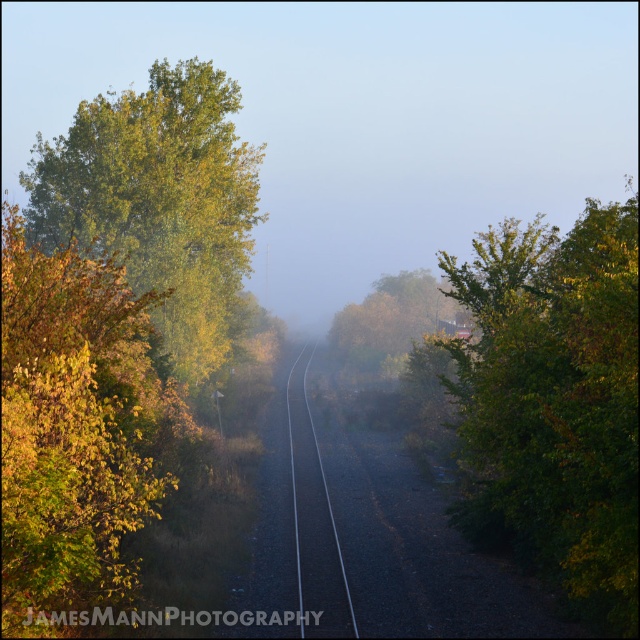
You are a photographer wanting to capture the golden foliage at left and the black asphalt train track at center in the same frame. Based on their positions, which object would you need to focus on first if you start from the left side?

The golden foliage at left is positioned on the left side of black asphalt train track at center, so you would need to focus on the golden foliage at left first since it is closer to the left side.

You are a railway inspector checking the tracks. You notice the foggy mist at center and the green leafy tree at right. Which object is higher in the scene?

The foggy mist at center is located above the green leafy tree at right, so it is higher in the scene.